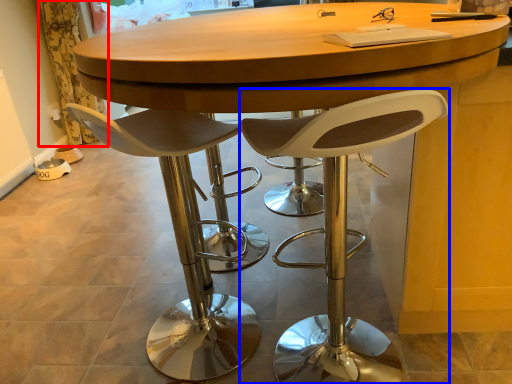
Question: Which object is further to the camera taking this photo, curtain (highlighted by a red box) or chair (highlighted by a blue box)?

Choices:
 (A) curtain
 (B) chair

Answer: (A)